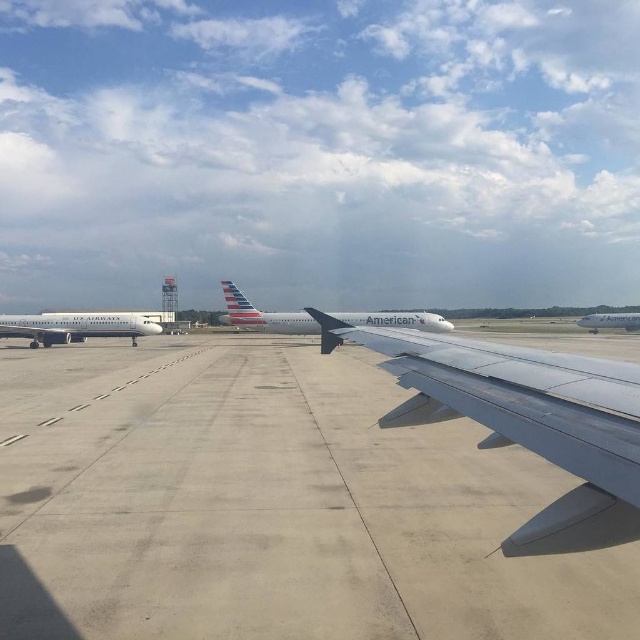
Question: Is metallic gray wing at center further to camera compared to silver metallic airplane at left?

Choices:
 (A) no
 (B) yes

Answer: (A)

Question: Is gray concrete tarmac at center positioned at the back of silver metallic airplane at center?

Choices:
 (A) no
 (B) yes

Answer: (A)

Question: Which object is positioned closest to the metallic gray wing at center?

Choices:
 (A) silver metallic airplane at center
 (B) white glossy airplane at center

Answer: (A)

Question: Which of these objects is positioned closest to the white glossy airplane at center?

Choices:
 (A) silver metallic airplane at center
 (B) metallic gray wing at center
 (C) silver metallic airplane at left
 (D) gray concrete tarmac at center

Answer: (A)

Question: Among these points, which one is farthest from the camera?

Choices:
 (A) (561, 518)
 (B) (120, 332)
 (C) (616, 314)
 (D) (269, 324)

Answer: (C)

Question: Does metallic gray wing at center appear under silver metallic airplane at center?

Choices:
 (A) no
 (B) yes

Answer: (B)